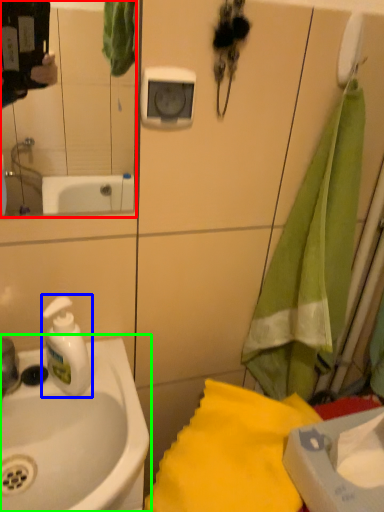
Question: Considering the real-world distances, which object is closest to mirror (highlighted by a red box)? soap dispenser (highlighted by a blue box) or sink (highlighted by a green box).

Choices:
 (A) soap dispenser
 (B) sink

Answer: (B)